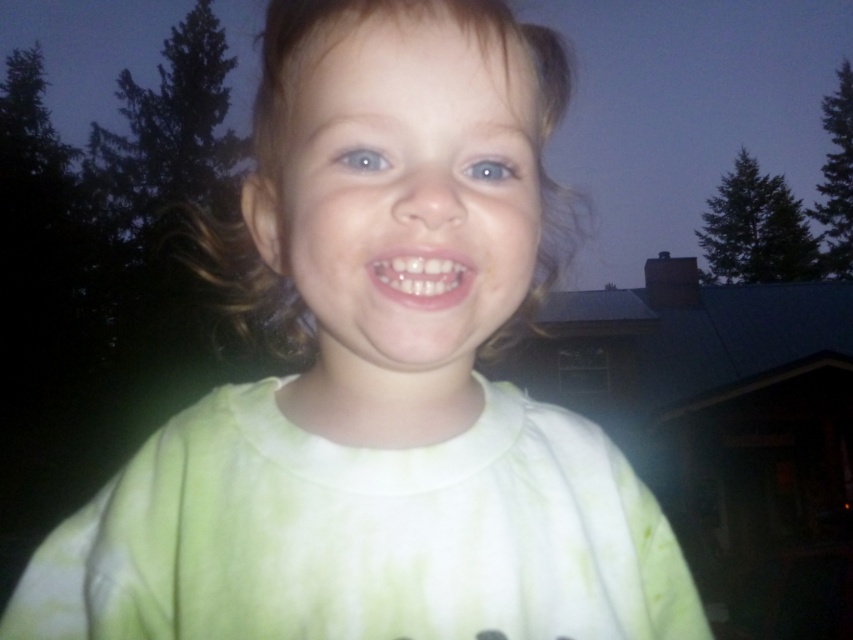
You are a photographer adjusting the focus on your camera. You notice a point at coordinates (401,172) in the image. What object does this point correspond to?

The point at coordinates (401,172) corresponds to the light green fabric face at center.

The child in the image is facing you. You want to place a sticker on the light green fabric face at center and the white glossy teeth at center. Which area requires a larger sticker?

The light green fabric face at center requires a larger sticker because it is wider than the white glossy teeth at center.

You are a photographer adjusting your camera focus. You notice two points in the image at coordinates point (488, 157) and point (357, 145). Which point is closer to the camera lens?

Point (488, 157) is further to the viewer than point (357, 145), so the point closer to the camera lens would be point (357, 145).